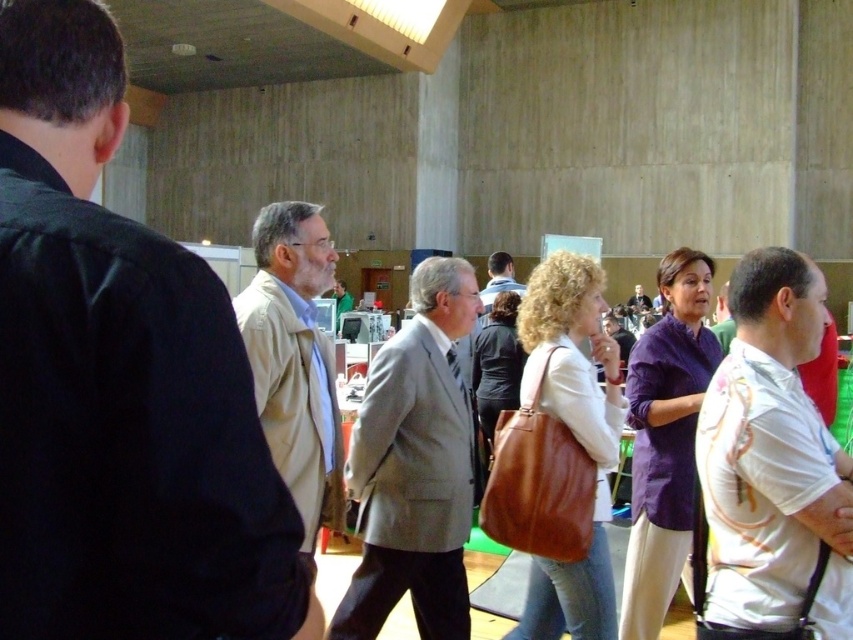
Question: Considering the relative positions of white printed shirt at center and light gray suit at center in the image provided, where is white printed shirt at center located with respect to light gray suit at center?

Choices:
 (A) right
 (B) left

Answer: (A)

Question: Among these objects, which one is farthest from the camera?

Choices:
 (A) beige fabric jacket at center
 (B) light beige suit at center
 (C) light gray suit at center
 (D) white printed shirt at center

Answer: (C)

Question: Considering the relative positions of white printed shirt at center and light gray suit at center in the image provided, where is white printed shirt at center located with respect to light gray suit at center?

Choices:
 (A) above
 (B) below

Answer: (A)

Question: Estimate the real-world distances between objects in this image. Which object is closer to the beige fabric jacket at center?

Choices:
 (A) light gray suit at center
 (B) white printed shirt at center

Answer: (A)

Question: Is white printed shirt at center wider than beige fabric jacket at center?

Choices:
 (A) no
 (B) yes

Answer: (B)

Question: Which object appears closest to the camera in this image?

Choices:
 (A) light beige suit at center
 (B) light gray suit at center

Answer: (A)